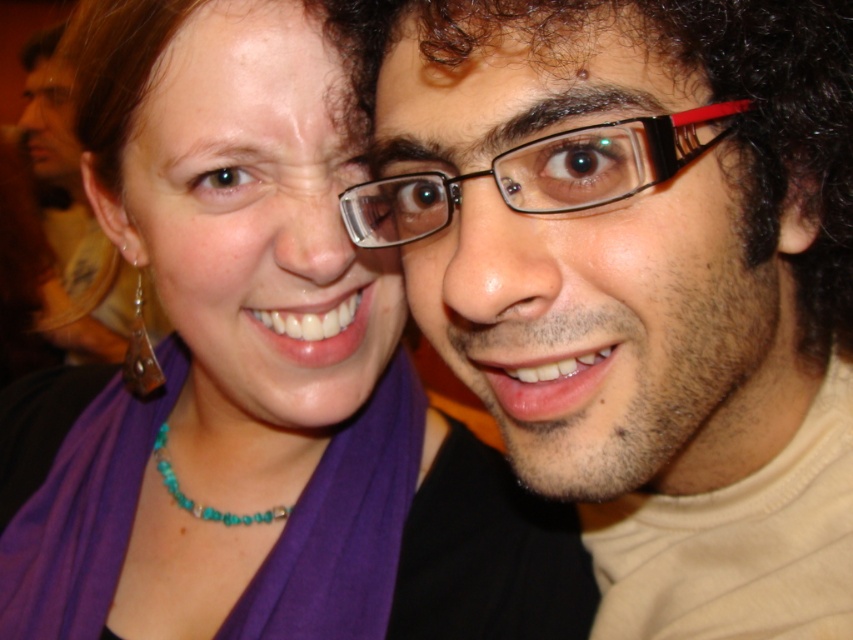
Question: Which of these objects is positioned closest to the turquoise beaded necklace at center?

Choices:
 (A) gold metallic earring at left
 (B) matte black glasses at upper right
 (C) black plastic glasses at center
 (D) purple fabric scarf at upper left

Answer: (A)

Question: Is purple fabric scarf at upper left above matte black glasses at upper right?

Choices:
 (A) no
 (B) yes

Answer: (A)

Question: Considering the real-world distances, which object is farthest from the black plastic glasses at center?

Choices:
 (A) matte black glasses at center
 (B) gold metallic earring at left
 (C) purple fabric scarf at upper left
 (D) matte black glasses at upper right

Answer: (D)

Question: Is matte black glasses at center below matte black glasses at upper right?

Choices:
 (A) yes
 (B) no

Answer: (A)

Question: Can you confirm if gold metallic earring at left is positioned below turquoise beaded necklace at center?

Choices:
 (A) no
 (B) yes

Answer: (A)

Question: Which point is closer to the camera taking this photo?

Choices:
 (A) (363, 243)
 (B) (799, 84)
 (C) (167, 490)
 (D) (293, 362)

Answer: (B)